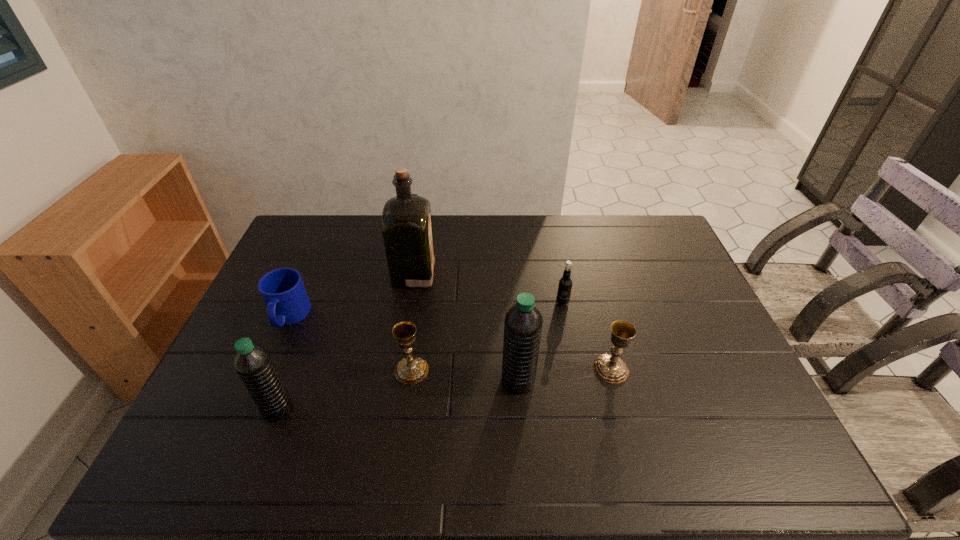
Locate an element on the screen. The image size is (960, 540). the nearer water bottle is located at coordinates (254, 365).

You are a GUI agent. You are given a task and a screenshot of the screen. Output one action in this format:
    pyautogui.click(x=<x>, y=<y>)
    Task: Click on the third tallest object
    
    Given the screenshot: What is the action you would take?
    pyautogui.click(x=254, y=365)

I want to click on the taller water bottle, so click(523, 322).

Image resolution: width=960 pixels, height=540 pixels. What are the coordinates of `the farther water bottle` in the screenshot? It's located at (523, 322).

Where is `the sixth object from left to right`? the sixth object from left to right is located at coordinates (565, 283).

Locate an element on the screen. liquor is located at coordinates (407, 231).

Locate an element on the screen. the farthest object is located at coordinates [x=407, y=231].

You are a GUI agent. You are given a task and a screenshot of the screen. Output one action in this format:
    pyautogui.click(x=<x>, y=<y>)
    Task: Click on the mug
    Image resolution: width=960 pixels, height=540 pixels.
    Given the screenshot: What is the action you would take?
    pyautogui.click(x=283, y=292)

Where is `the left chalice`? The width and height of the screenshot is (960, 540). the left chalice is located at coordinates (411, 370).

This screenshot has width=960, height=540. Identify the location of the rightmost object. (609, 368).